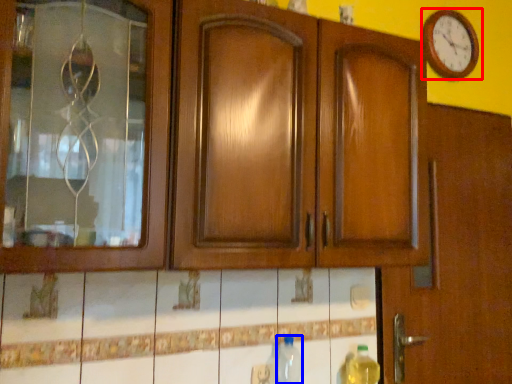
Question: Among these objects, which one is farthest to the camera, wall clock (highlighted by a red box) or bottle (highlighted by a blue box)?

Choices:
 (A) wall clock
 (B) bottle

Answer: (A)